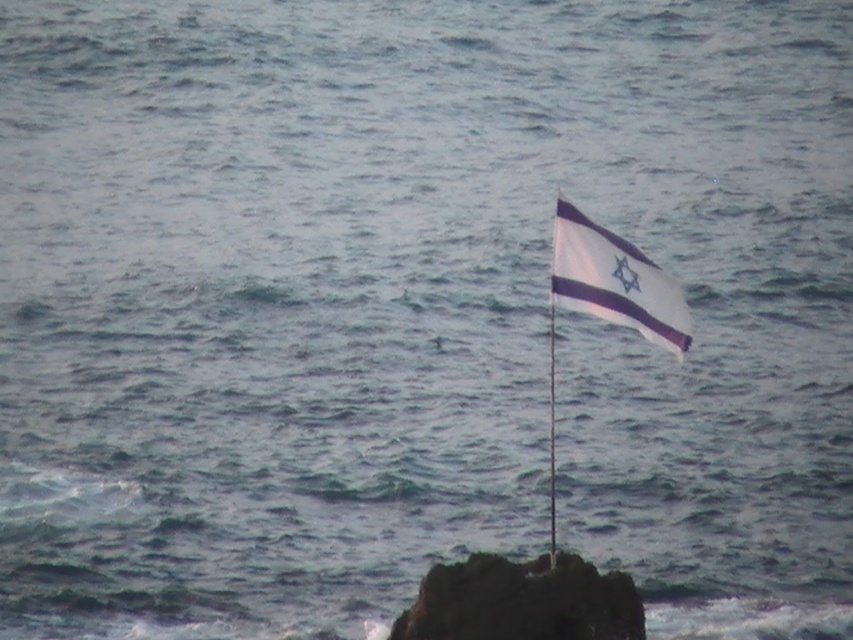
Question: Is rough textured rock at center above white fabric flag at upper right?

Choices:
 (A) yes
 (B) no

Answer: (B)

Question: Does rough textured rock at center appear on the left side of white fabric flag at upper right?

Choices:
 (A) yes
 (B) no

Answer: (A)

Question: Is rough textured rock at center bigger than white fabric flag at upper right?

Choices:
 (A) yes
 (B) no

Answer: (A)

Question: Which of the following is the closest to the observer?

Choices:
 (A) (567, 284)
 (B) (523, 589)

Answer: (B)